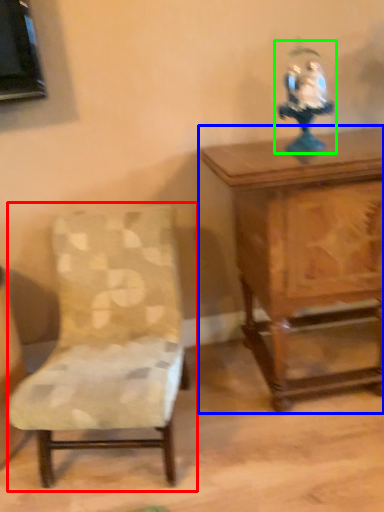
Question: Considering the real-world distances, which object is farthest from chair (highlighted by a red box)? table (highlighted by a blue box) or toy (highlighted by a green box)?

Choices:
 (A) table
 (B) toy

Answer: (B)